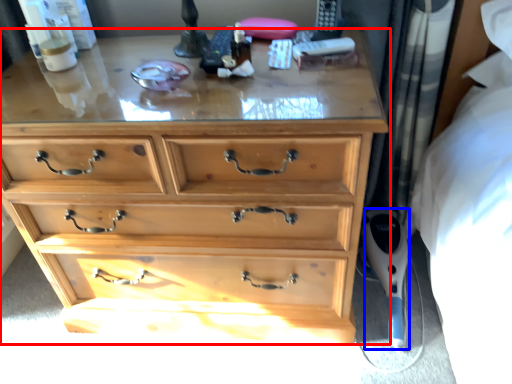
Question: Among these objects, which one is nearest to the camera, chest of drawers (highlighted by a red box) or equipment (highlighted by a blue box)?

Choices:
 (A) chest of drawers
 (B) equipment

Answer: (A)